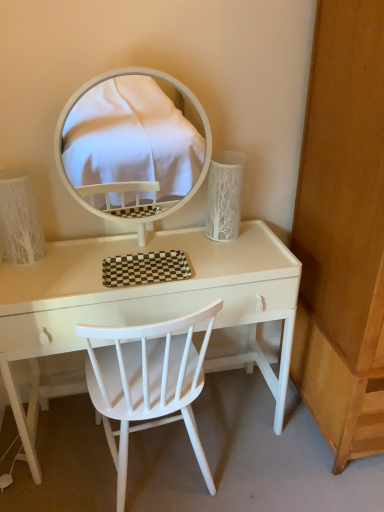
Question: Can you confirm if white glossy table at center is thinner than white textured vase at right, which is the 2th table lamp from left to right?

Choices:
 (A) no
 (B) yes

Answer: (A)

Question: Considering the relative positions of white glossy table at center and white textured vase at right, which is the first table lamp from right to left, in the image provided, is white glossy table at center to the left of white textured vase at right, which is the first table lamp from right to left, from the viewer's perspective?

Choices:
 (A) yes
 (B) no

Answer: (A)

Question: From a real-world perspective, does white glossy table at center stand above white textured vase at right, which is the first table lamp from right to left?

Choices:
 (A) yes
 (B) no

Answer: (B)

Question: Is white glossy table at center turned away from white textured vase at right, which is the 2th table lamp from left to right?

Choices:
 (A) yes
 (B) no

Answer: (B)

Question: From the image's perspective, is white glossy table at center below white textured vase at right, which is the first table lamp from right to left?

Choices:
 (A) no
 (B) yes

Answer: (B)

Question: Can you confirm if white glossy table at center is bigger than white textured vase at right, which is the first table lamp from right to left?

Choices:
 (A) no
 (B) yes

Answer: (B)

Question: Is white glossy table at center far from wooden dresser at right?

Choices:
 (A) no
 (B) yes

Answer: (A)

Question: Can you see white glossy table at center touching wooden dresser at right?

Choices:
 (A) yes
 (B) no

Answer: (B)

Question: Can you confirm if white glossy table at center is smaller than wooden dresser at right?

Choices:
 (A) yes
 (B) no

Answer: (A)

Question: Is the depth of white glossy table at center greater than that of wooden dresser at right?

Choices:
 (A) yes
 (B) no

Answer: (A)

Question: Does white glossy table at center have a lesser width compared to wooden dresser at right?

Choices:
 (A) yes
 (B) no

Answer: (A)

Question: Considering the relative sizes of white glossy table at center and wooden dresser at right in the image provided, is white glossy table at center shorter than wooden dresser at right?

Choices:
 (A) no
 (B) yes

Answer: (B)

Question: From the image's perspective, is white glossy table at center beneath white textured lampshade at left, which appears as the 2th table lamp when viewed from the right?

Choices:
 (A) no
 (B) yes

Answer: (B)